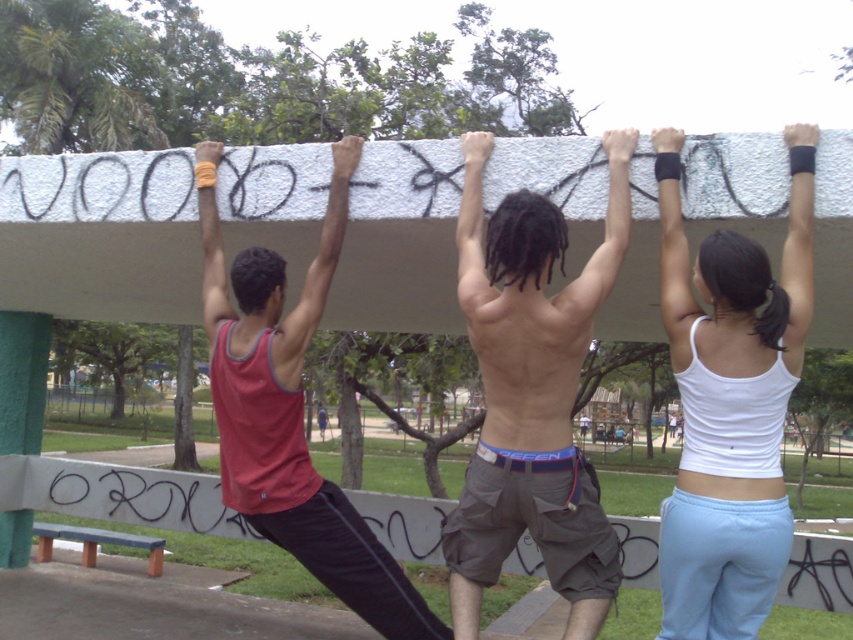
Question: Estimate the real-world distances between objects in this image. Which object is farther from the shiny metallic shorts at center?

Choices:
 (A) matte red tank top at center
 (B) white fabric tank top at upper center

Answer: (A)

Question: Can you confirm if shiny metallic shorts at center is wider than matte red tank top at center?

Choices:
 (A) no
 (B) yes

Answer: (A)

Question: Is white fabric tank top at upper center closer to camera compared to shiny metallic shorts at center?

Choices:
 (A) yes
 (B) no

Answer: (A)

Question: Is shiny metallic shorts at center to the left of matte red tank top at center from the viewer's perspective?

Choices:
 (A) yes
 (B) no

Answer: (B)

Question: Which point is closer to the camera?

Choices:
 (A) white fabric tank top at upper center
 (B) shiny metallic shorts at center

Answer: (A)

Question: Among these points, which one is nearest to the camera?

Choices:
 (A) (538, 243)
 (B) (288, 403)
 (C) (712, 449)

Answer: (A)